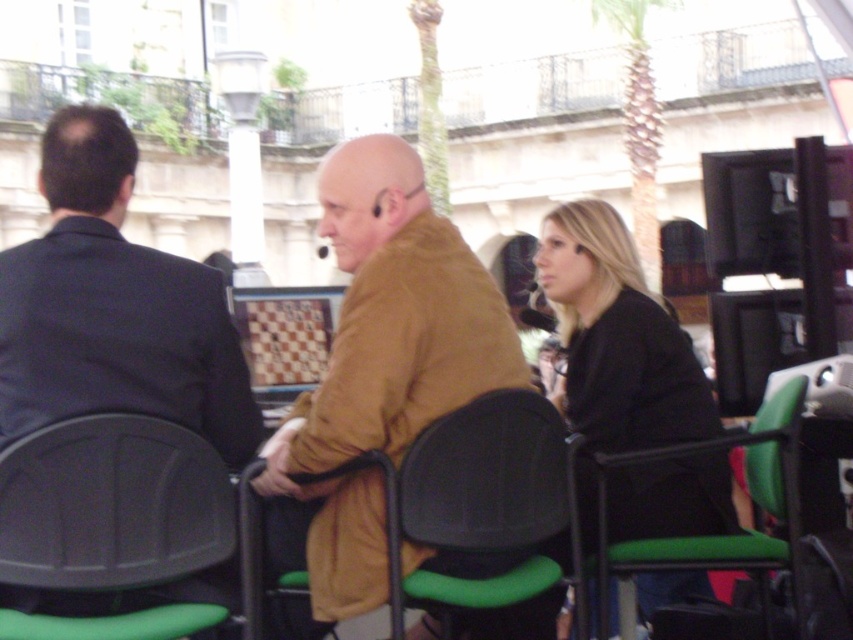
Is brown leather jacket at center closer to camera compared to black matte jacket at center?

That is True.

Describe the element at coordinates (384, 360) in the screenshot. I see `brown leather jacket at center` at that location.

Where is `brown leather jacket at center`? Image resolution: width=853 pixels, height=640 pixels. brown leather jacket at center is located at coordinates (384, 360).

Who is more distant from viewer, (192, 365) or (511, 570)?

The point (511, 570) is behind.

Between dark blue suit at left and black plastic chair at center, which one is positioned higher?

dark blue suit at left is above.

Which is behind, point (12, 380) or point (399, 579)?

The point (399, 579) is behind.

Locate an element on the screen. dark blue suit at left is located at coordinates (113, 307).

Between matte plastic chair at left and green plastic chair at right, which one is positioned lower?

green plastic chair at right is below.

Who is more distant from viewer, (x=10, y=490) or (x=648, y=561)?

The point (x=648, y=561) is behind.

Find the location of `matte plastic chair at left`. matte plastic chair at left is located at coordinates (112, 504).